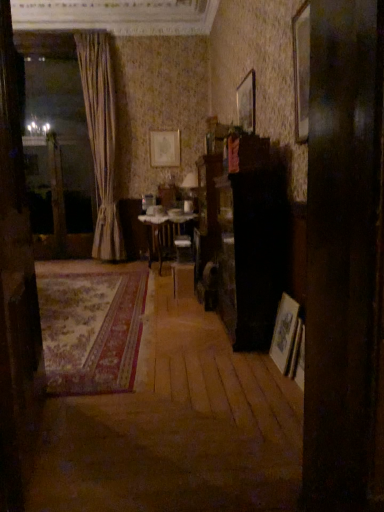
Identify the location of empty space that is to the right of wooden door at left. The image size is (384, 512). (154, 444).